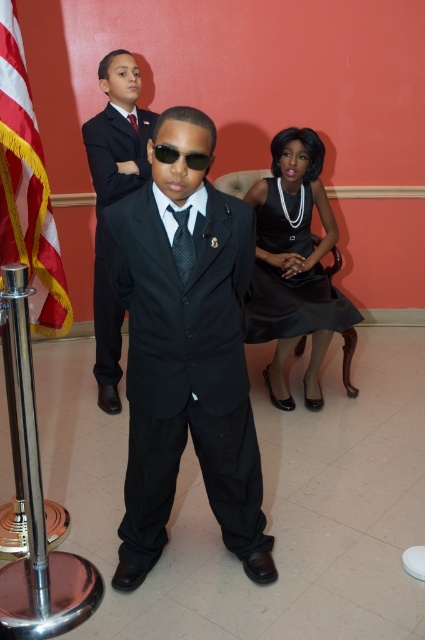
Question: Which of the following is the farthest from the observer?

Choices:
 (A) black satin suit at center
 (B) black dotted tie at center
 (C) black textured tie at center
 (D) matte black suit at center

Answer: (C)

Question: Is red-white striped flag at left in front of black satin dress at center?

Choices:
 (A) yes
 (B) no

Answer: (A)

Question: Can you confirm if red-white striped flag at left is smaller than black satin suit at center?

Choices:
 (A) yes
 (B) no

Answer: (A)

Question: Does matte black suit at center appear under black reflective sunglasses at center?

Choices:
 (A) no
 (B) yes

Answer: (B)

Question: Which object appears closest to the camera in this image?

Choices:
 (A) black satin suit at center
 (B) matte black suit at center

Answer: (B)

Question: Estimate the real-world distances between objects in this image. Which object is farther from the black reflective sunglasses at center?

Choices:
 (A) matte black suit at center
 (B) black satin dress at center
 (C) black dotted tie at center

Answer: (B)